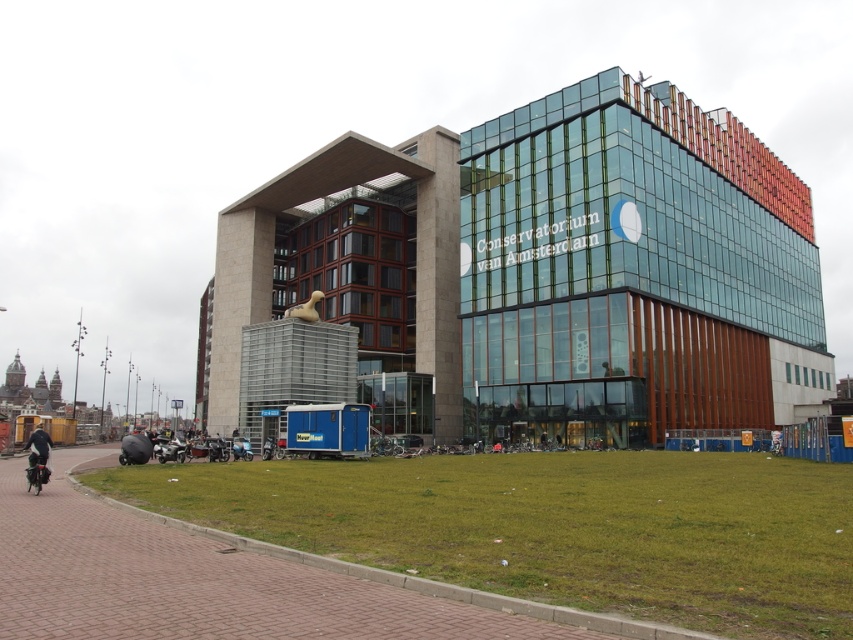
You are a visitor at the Conservatorium van Amsterdam and want to park your car. There are two motorcycles blocking the entrance path. The metallic silver motorcycle at lower left and the shiny blue motorcycle at center. Which motorcycle is closer to you and must be moved first?

The metallic silver motorcycle at lower left is closer to the viewer than the shiny blue motorcycle at center, so you must move the metallic silver motorcycle at lower left first.

What is the 2D coordinate of the black matte motorcycle at lower left in the image?

The 2D coordinate of the black matte motorcycle at lower left is at point (36, 472).